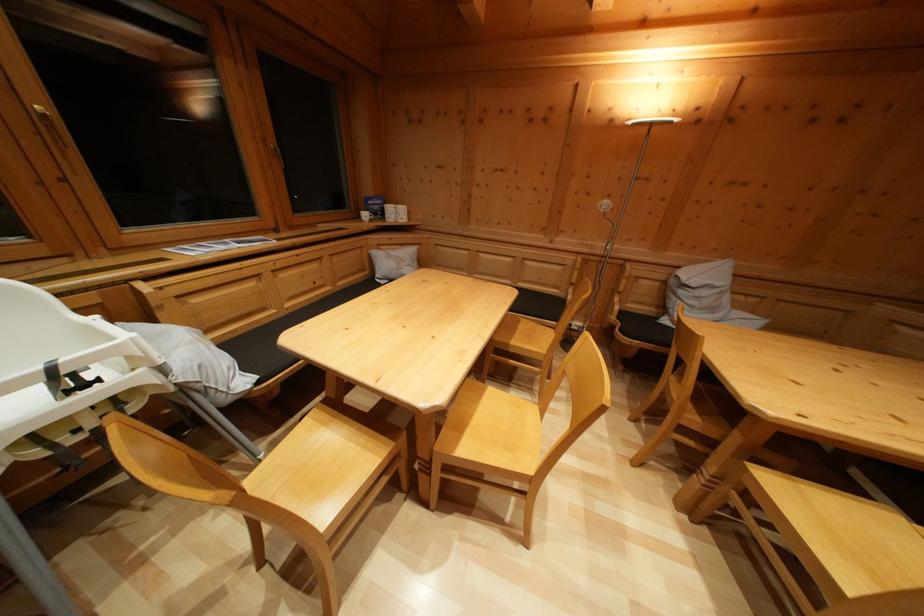
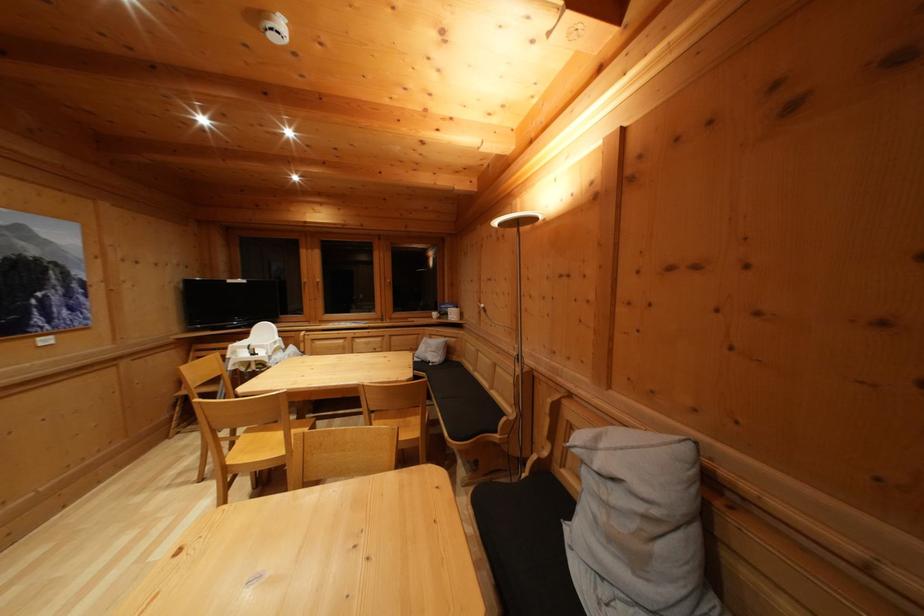
Locate, in the second image, the point that corresponds to (57,377) in the first image.

(254, 353)